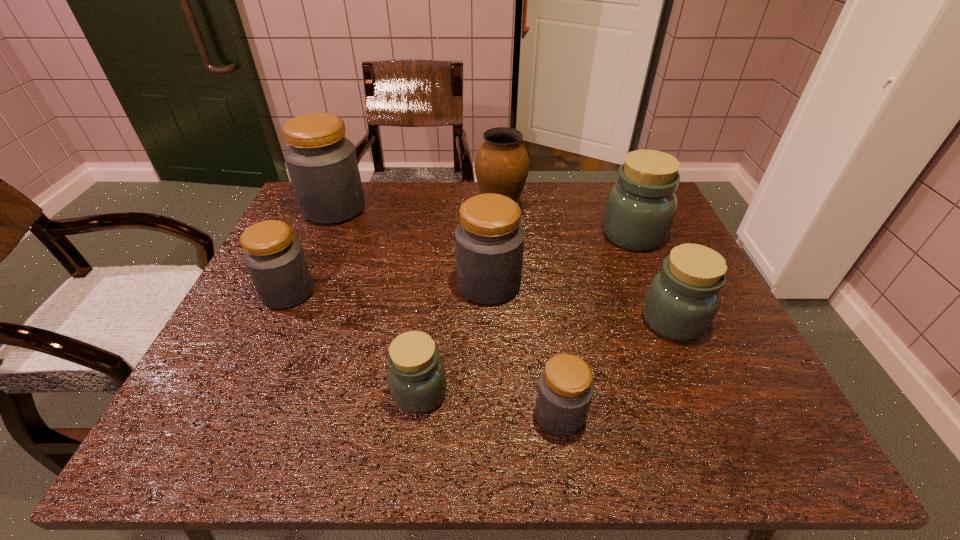
In order to click on free point between the smallest green jar and the biggest green jar in this screenshot , I will do `click(526, 314)`.

At what (x,y) coordinates should I click in order to perform the action: click on object that is the fifth closest to the brown urn. Please return your answer as a coordinate pair (x, y). Image resolution: width=960 pixels, height=540 pixels. Looking at the image, I should click on (275, 260).

Where is `the closest object to the second smallest gray jar`? This screenshot has width=960, height=540. the closest object to the second smallest gray jar is located at coordinates [x=322, y=164].

Locate an element on the screen. jar that is the sixth closest to the urn is located at coordinates (416, 375).

Where is `jar that is the fifth closest to the second smallest gray jar`? The image size is (960, 540). jar that is the fifth closest to the second smallest gray jar is located at coordinates (640, 209).

Select which gray jar is the second closest to the farthest gray jar. Please provide its 2D coordinates. Your answer should be formatted as a tuple, i.e. [(x, y)], where the tuple contains the x and y coordinates of a point satisfying the conditions above.

[(489, 241)]

Locate which gray jar ranks second in proximity to the fifth jar from left to right. Please provide its 2D coordinates. Your answer should be formatted as a tuple, i.e. [(x, y)], where the tuple contains the x and y coordinates of a point satisfying the conditions above.

[(275, 260)]

You are a GUI agent. You are given a task and a screenshot of the screen. Output one action in this format:
    pyautogui.click(x=<x>, y=<y>)
    Task: Click on the green jar that can be found as the second closest to the nearest gray jar
    Image resolution: width=960 pixels, height=540 pixels.
    Given the screenshot: What is the action you would take?
    pyautogui.click(x=682, y=300)

Identify which green jar is the second nearest to the brown urn. Please provide its 2D coordinates. Your answer should be formatted as a tuple, i.e. [(x, y)], where the tuple contains the x and y coordinates of a point satisfying the conditions above.

[(682, 300)]

Identify the location of free region that satisfies the following two spatial constraints: 1. on the surface of the farthest green jar near the warning symbol; 2. on the right side of the farthest gray jar. (323, 234).